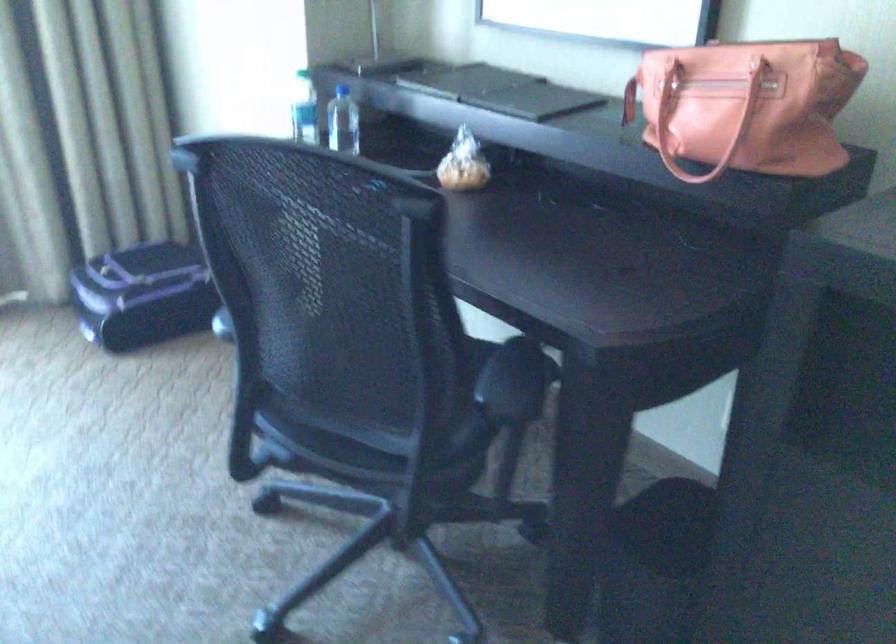
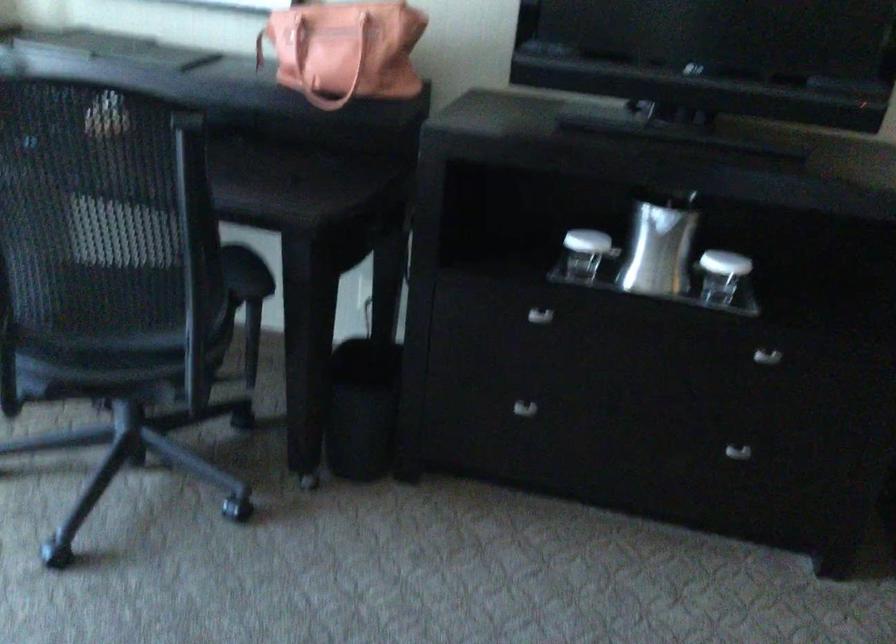
Where in the second image is the point corresponding to point (686, 111) from the first image?

(315, 57)